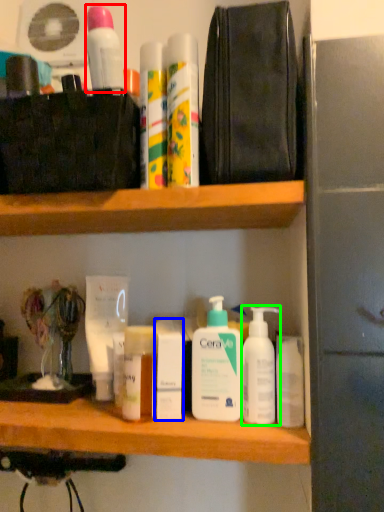
Question: Based on their relative distances, which object is farther from mouthwash (highlighted by a red box)? Choose from toiletry (highlighted by a blue box) and cleaning product (highlighted by a green box).

Choices:
 (A) toiletry
 (B) cleaning product

Answer: (B)